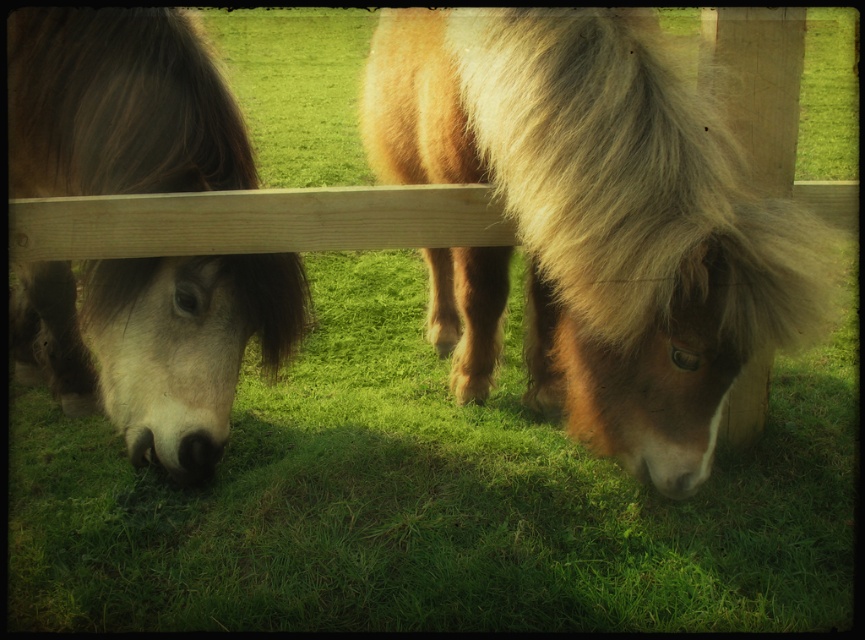
Question: Does brown fuzzy pony at center appear over brown fuzzy horse at left?

Choices:
 (A) yes
 (B) no

Answer: (A)

Question: Can you confirm if brown fuzzy pony at center is smaller than brown fuzzy horse at left?

Choices:
 (A) yes
 (B) no

Answer: (B)

Question: Among these objects, which one is farthest from the camera?

Choices:
 (A) brown fuzzy horse at left
 (B) brown fuzzy pony at center

Answer: (A)

Question: Does brown fuzzy pony at center appear on the left side of brown fuzzy horse at left?

Choices:
 (A) yes
 (B) no

Answer: (B)

Question: Which point is farther from the camera taking this photo?

Choices:
 (A) (130, 84)
 (B) (755, 330)

Answer: (A)